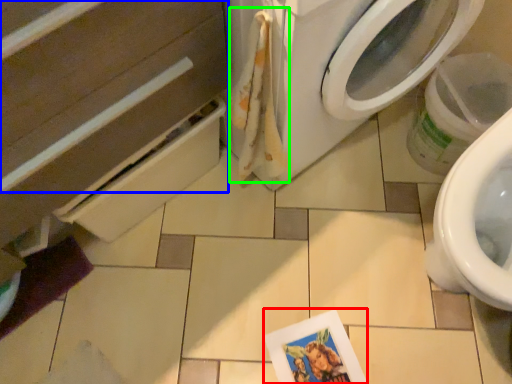
Question: Estimate the real-world distances between objects in this image. Which object is closer to postcard (highlighted by a red box), drawer (highlighted by a blue box) or laundry (highlighted by a green box)?

Choices:
 (A) drawer
 (B) laundry

Answer: (B)